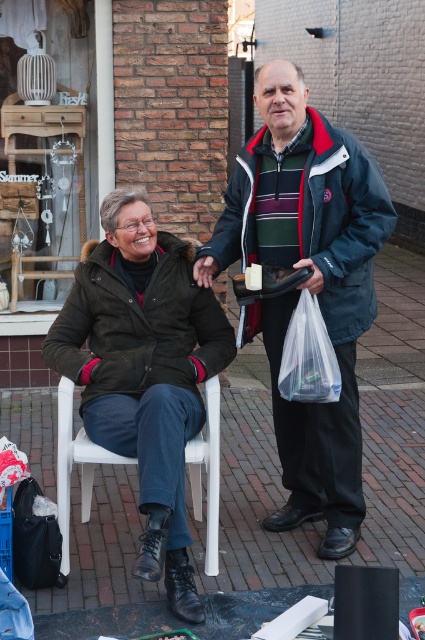
You are a photographer trying to capture a candid shot of the two people in the scene. You notice the matte black jacket at center and the matte black bag at lower left. Which object should you focus on first if you want to ensure both are in sharp focus?

The matte black jacket at center is closer to the viewer than the matte black bag at lower left. To ensure both are in sharp focus, you should focus on the matte black jacket at center first because it is closer, and then adjust the focus to include the matte black bag at lower left within the depth of field.

You are a photographer trying to capture a candid shot of the dark blue jacket at center and the matte black bag at lower left. Since you want to ensure both subjects are in focus, you need to know which one is taller. Can you determine which object is taller?

The dark blue jacket at center has a greater height compared to the matte black bag at lower left, so the dark blue jacket at center is taller.